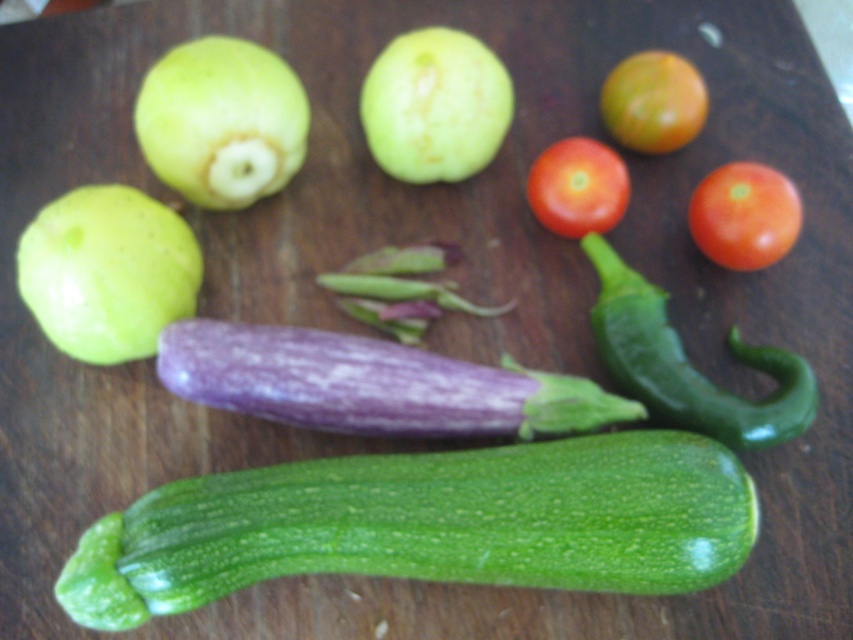
Can you confirm if green matte zucchini at lower center is positioned to the left of green glossy chili pepper at center right?

Correct, you'll find green matte zucchini at lower center to the left of green glossy chili pepper at center right.

Can you confirm if green matte zucchini at lower center is taller than green glossy chili pepper at center right?

In fact, green matte zucchini at lower center may be shorter than green glossy chili pepper at center right.

I want to click on green matte zucchini at lower center, so click(428, 524).

The width and height of the screenshot is (853, 640). Identify the location of green matte zucchini at lower center. (428, 524).

Based on the photo, does green matte turnip at upper left appear on the right side of green matte apple at upper center?

In fact, green matte turnip at upper left is to the left of green matte apple at upper center.

Locate an element on the screen. This screenshot has height=640, width=853. green matte turnip at upper left is located at coordinates (221, 122).

Is point (242, 147) closer to camera compared to point (412, 132)?

Yes, it is in front of point (412, 132).

Locate an element on the screen. The width and height of the screenshot is (853, 640). green matte turnip at upper left is located at coordinates (221, 122).

Image resolution: width=853 pixels, height=640 pixels. I want to click on purple matte eggplant at center, so click(372, 385).

Who is taller, purple matte eggplant at center or green glossy chili pepper at center right?

green glossy chili pepper at center right

Does point (271, 396) lie in front of point (648, 362)?

Yes, it is.

You are a GUI agent. You are given a task and a screenshot of the screen. Output one action in this format:
    pyautogui.click(x=<x>, y=<y>)
    Task: Click on the purple matte eggplant at center
    The image size is (853, 640).
    Given the screenshot: What is the action you would take?
    pyautogui.click(x=372, y=385)